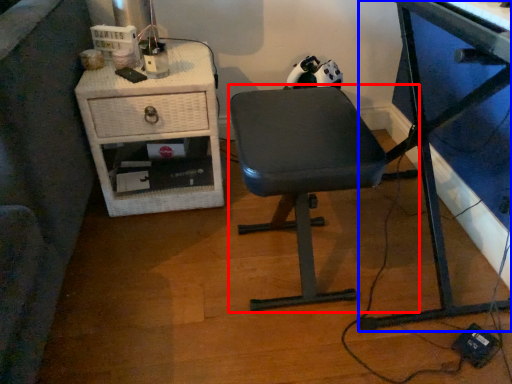
Question: Among these objects, which one is farthest to the camera, chair (highlighted by a red box) or desk (highlighted by a blue box)?

Choices:
 (A) chair
 (B) desk

Answer: (A)